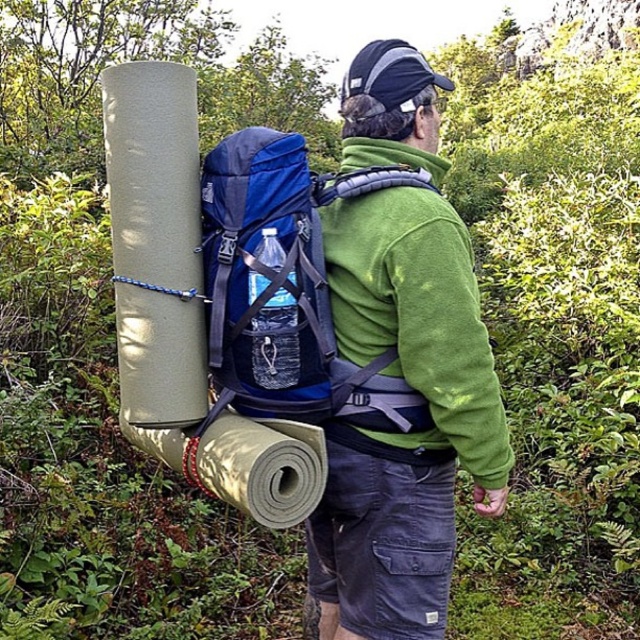
You are a hiker trying to navigate through the forest. You see two points in the image, one at coordinates point (212, 212) and another at point (332, 248). Which point is closer to you?

Point (212, 212) is closer to the viewer than point (332, 248).

You are a hiker planning to carry a 20cm wide first aid kit. You see the blue fabric backpack at center and the green fleece jacket at back. Which item can accommodate the first aid kit if the backpack is wider than the jacket?

The blue fabric backpack at center can accommodate the first aid kit since its width surpasses the green fleece jacket at back.

In the scene shown: You are a hiker preparing to adjust your gear. You have a blue fabric backpack at center and a green fleece jacket at back. Which item is shorter in height?

The blue fabric backpack at center has a lesser height compared to the green fleece jacket at back, so the backpack is shorter.